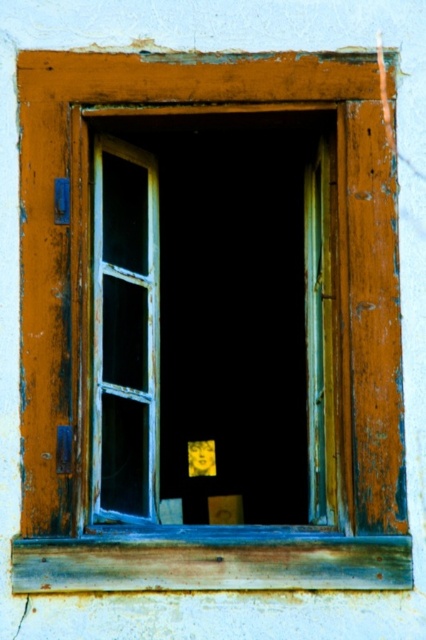
You are an interior designer assessing a room with a wooden frame window at center and a rusty wood window sill at lower center. Which object would cast a longer shadow if the light is coming from above?

The wooden frame window at center is much taller than the rusty wood window sill at lower center, so it would cast a longer shadow when light comes from above.